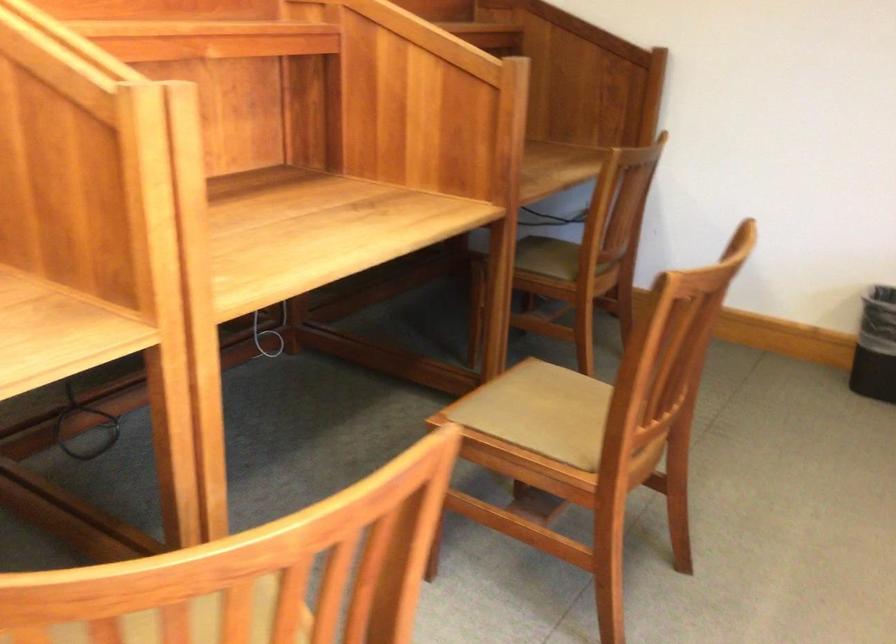
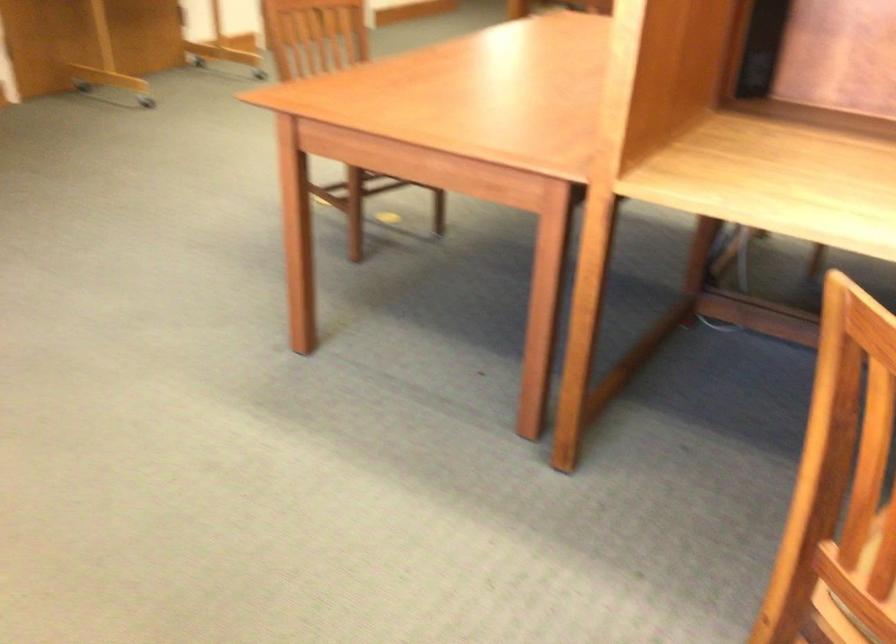
The images are taken continuously from a first-person perspective. In which direction is your viewpoint rotating?

The camera's rotation is toward left-down.